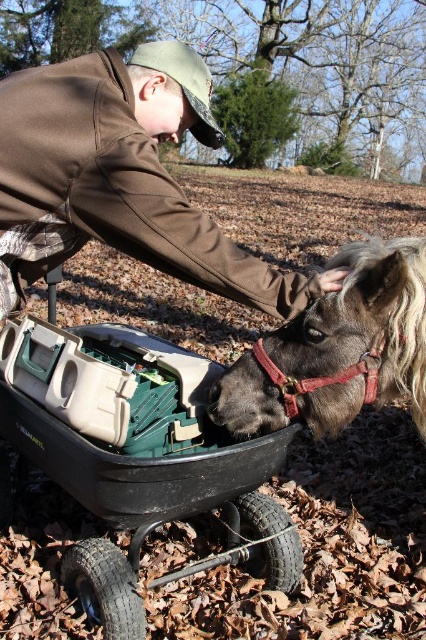
You are a delivery person trying to load a package into the black plastic wagon at lower center. The dark brown leather horse at center is blocking the wagon. Can you lift the package over the horse to place it in the wagon?

The black plastic wagon at lower center has a greater height compared to the dark brown leather horse at center, so yes, you can lift the package over the horse to place it in the wagon since the wagon is taller than the horse.